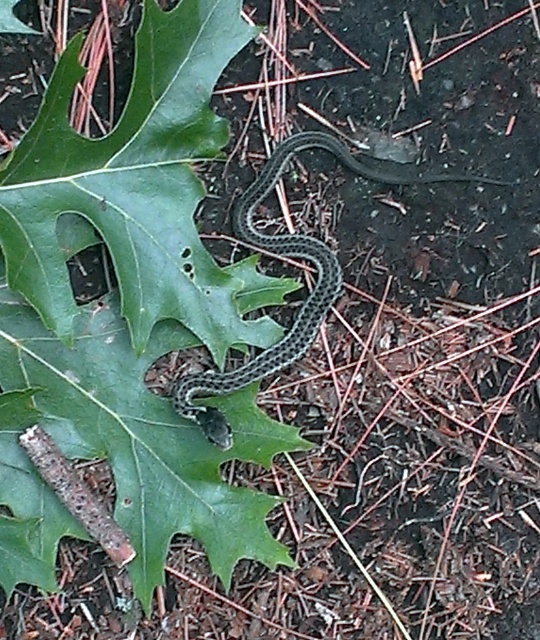
Between green matte leaf at center and green textured snake at center, which one appears on the right side from the viewer's perspective?

green textured snake at center

Measure the distance between point (145, 538) and camera.

Point (145, 538) is 4.64 feet away from camera.

What do you see at coordinates (139, 292) in the screenshot? This screenshot has height=640, width=540. I see `green matte leaf at center` at bounding box center [139, 292].

Locate an element on the screen. The height and width of the screenshot is (640, 540). green matte leaf at center is located at coordinates (139, 292).